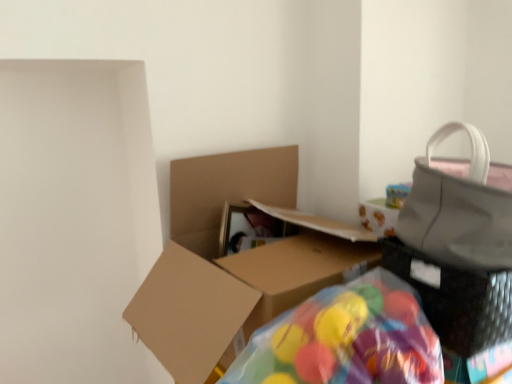
The width and height of the screenshot is (512, 384). Identify the location of translucent plastic bean bag chair at lower center. (346, 339).

Locate an element on the screen. translucent plastic bean bag chair at lower center is located at coordinates (346, 339).

Considering the relative positions of matte gray handbag at right and translucent plastic bean bag chair at lower center in the image provided, is matte gray handbag at right to the left or to the right of translucent plastic bean bag chair at lower center?

Based on their positions, matte gray handbag at right is located to the right of translucent plastic bean bag chair at lower center.

Looking at the image, does matte gray handbag at right seem bigger or smaller compared to translucent plastic bean bag chair at lower center?

Considering their sizes, matte gray handbag at right takes up more space than translucent plastic bean bag chair at lower center.

Are matte gray handbag at right and translucent plastic bean bag chair at lower center located far from each other?

No, matte gray handbag at right is not far away from translucent plastic bean bag chair at lower center.

In the scene shown: Is matte gray handbag at right completely or partially outside of translucent plastic bean bag chair at lower center?

That's correct, matte gray handbag at right is outside of translucent plastic bean bag chair at lower center.

Is translucent plastic bean bag chair at lower center facing towards matte gray handbag at right?

No, translucent plastic bean bag chair at lower center does not turn towards matte gray handbag at right.

This screenshot has height=384, width=512. I want to click on handbag on the right of the translucent plastic bean bag chair at lower center, so click(x=460, y=206).

Could you measure the distance between translucent plastic bean bag chair at lower center and matte gray handbag at right?

translucent plastic bean bag chair at lower center and matte gray handbag at right are 8.35 inches apart.

From a real-world perspective, does translucent plastic bean bag chair at lower center sit lower than matte gray handbag at right?

Yes, from a real-world perspective, translucent plastic bean bag chair at lower center is below matte gray handbag at right.

Can you tell me how much translucent plastic bean bag chair at lower center and brown cardboard box at center differ in facing direction?

The facing directions of translucent plastic bean bag chair at lower center and brown cardboard box at center are 0.00152 degrees apart.

From a real-world perspective, is translucent plastic bean bag chair at lower center physically below brown cardboard box at center?

Yes.

Does translucent plastic bean bag chair at lower center have a greater height compared to brown cardboard box at center?

No.

Can you confirm if translucent plastic bean bag chair at lower center is bigger than brown cardboard box at center?

Actually, translucent plastic bean bag chair at lower center might be smaller than brown cardboard box at center.

Between brown cardboard box at center and translucent plastic bean bag chair at lower center, which one has larger size?

brown cardboard box at center is bigger.

Can you confirm if brown cardboard box at center is wider than translucent plastic bean bag chair at lower center?

Correct, the width of brown cardboard box at center exceeds that of translucent plastic bean bag chair at lower center.

Is brown cardboard box at center positioned in front of translucent plastic bean bag chair at lower center?

No, brown cardboard box at center is further to the viewer.

Are brown cardboard box at center and matte gray handbag at right making contact?

No, brown cardboard box at center is not beside matte gray handbag at right.

From a real-world perspective, relative to matte gray handbag at right, is brown cardboard box at center vertically above or below?

In terms of real-world spatial position, brown cardboard box at center is below matte gray handbag at right.

Can you tell me how much brown cardboard box at center and matte gray handbag at right differ in facing direction?

There is a 3.8-degree angle between the facing directions of brown cardboard box at center and matte gray handbag at right.

Is matte gray handbag at right far away from brown cardboard box at center?

No.

Measure the distance from matte gray handbag at right to brown cardboard box at center.

The distance of matte gray handbag at right from brown cardboard box at center is 39.10 centimeters.

Would you say matte gray handbag at right is inside or outside brown cardboard box at center?

The correct answer is: outside.

In the scene shown: Can you confirm if matte gray handbag at right is bigger than brown cardboard box at center?

Actually, matte gray handbag at right might be smaller than brown cardboard box at center.

Identify the location of bean bag chair located on the left of matte gray handbag at right. Image resolution: width=512 pixels, height=384 pixels. (346, 339).

Where is `handbag above the translucent plastic bean bag chair at lower center (from a real-world perspective)`? This screenshot has width=512, height=384. handbag above the translucent plastic bean bag chair at lower center (from a real-world perspective) is located at coordinates (460, 206).

Looking at the image, which one is located further to brown cardboard box at center, matte gray handbag at right or translucent plastic bean bag chair at lower center?

matte gray handbag at right is positioned further to the anchor brown cardboard box at center.

When comparing their distances from brown cardboard box at center, does translucent plastic bean bag chair at lower center or matte gray handbag at right seem further?

Among the two, matte gray handbag at right is located further to brown cardboard box at center.

From the image, which object appears to be nearer to translucent plastic bean bag chair at lower center, matte gray handbag at right or brown cardboard box at center?

matte gray handbag at right lies closer to translucent plastic bean bag chair at lower center than the other object.

Based on their spatial positions, is translucent plastic bean bag chair at lower center or brown cardboard box at center closer to matte gray handbag at right?

translucent plastic bean bag chair at lower center.

Estimate the real-world distances between objects in this image. Which object is closer to matte gray handbag at right, brown cardboard box at center or translucent plastic bean bag chair at lower center?

translucent plastic bean bag chair at lower center is closer to matte gray handbag at right.

Looking at the image, which one is located further to translucent plastic bean bag chair at lower center, brown cardboard box at center or matte gray handbag at right?

brown cardboard box at center.

The width and height of the screenshot is (512, 384). I want to click on bean bag chair located between brown cardboard box at center and matte gray handbag at right in the left-right direction, so [346, 339].